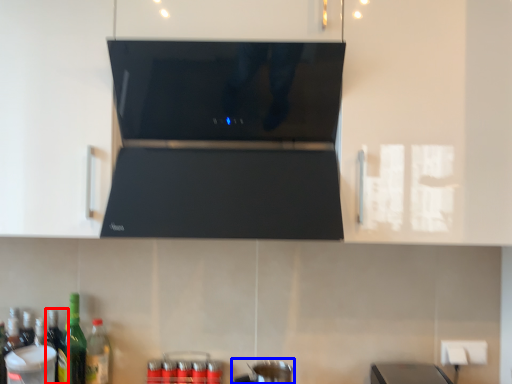
Question: Among these objects, which one is nearest to the camera, bottle (highlighted by a red box) or appliance (highlighted by a blue box)?

Choices:
 (A) bottle
 (B) appliance

Answer: (B)